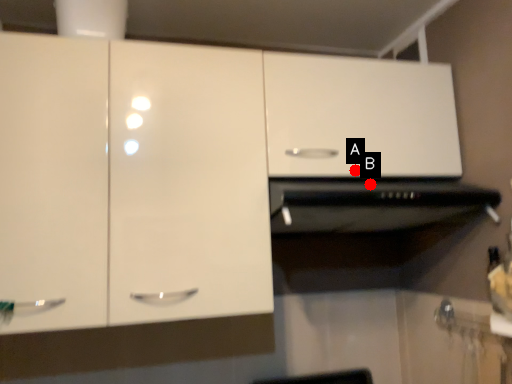
Question: Two points are circled on the image, labeled by A and B beside each circle. Which of the following is the farthest from the observer?

Choices:
 (A) A is further
 (B) B is further

Answer: (B)